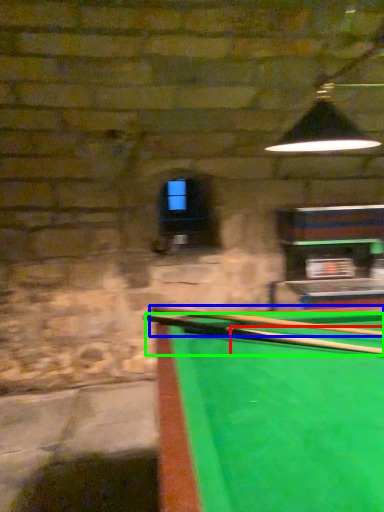
Question: Based on their relative distances, which object is nearer to cue (highlighted by a red box)? Choose from cue (highlighted by a blue box) and cue (highlighted by a green box).

Choices:
 (A) cue
 (B) cue

Answer: (B)